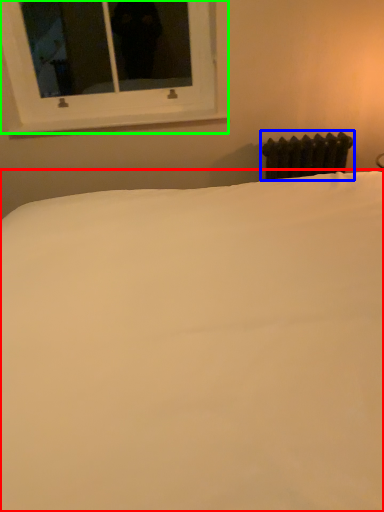
Question: Which object is the farthest from bed (highlighted by a red box)? Choose among these: radiator (highlighted by a blue box) or window (highlighted by a green box).

Choices:
 (A) radiator
 (B) window

Answer: (B)